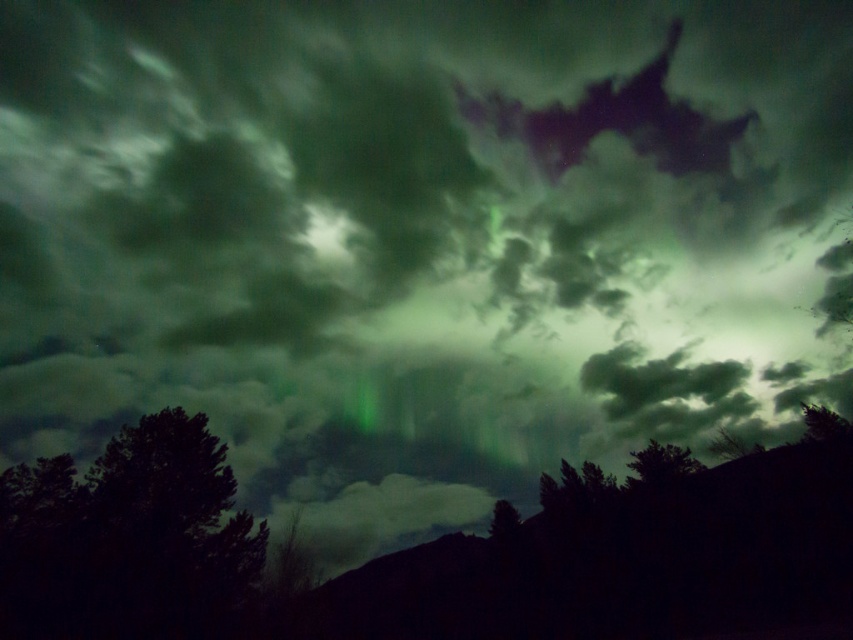
Question: Considering the relative positions of dark green textured tree at lower left and green translucent cloud at center in the image provided, where is dark green textured tree at lower left located with respect to green translucent cloud at center?

Choices:
 (A) right
 (B) left

Answer: (B)

Question: Can you confirm if dark green textured tree at lower left is positioned to the left of green matte tree at lower center?

Choices:
 (A) yes
 (B) no

Answer: (A)

Question: Is dark green textured tree at lower left further to the viewer compared to green matte tree at lower center?

Choices:
 (A) yes
 (B) no

Answer: (B)

Question: Which is nearer to the green translucent cloud at center?

Choices:
 (A) green matte tree at lower right
 (B) dark green textured tree at lower left

Answer: (A)

Question: Which object is closer to the camera taking this photo?

Choices:
 (A) green translucent cloud at center
 (B) green matte tree at lower center
 (C) dark green textured tree at lower left
 (D) green matte tree at lower right

Answer: (C)

Question: Which point appears farthest from the camera in this image?

Choices:
 (A) (660, 449)
 (B) (495, 529)
 (C) (12, 516)

Answer: (B)